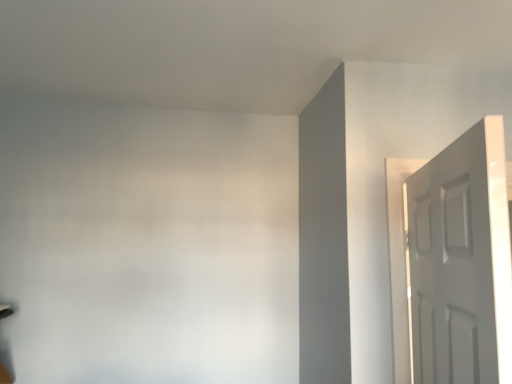
Where is `white matte door at right`? white matte door at right is located at coordinates (453, 263).

The width and height of the screenshot is (512, 384). What do you see at coordinates (453, 263) in the screenshot?
I see `white matte door at right` at bounding box center [453, 263].

Measure the distance between point (x=442, y=178) and camera.

Point (x=442, y=178) and camera are 3.71 feet apart.

Identify the location of white matte door at right. Image resolution: width=512 pixels, height=384 pixels. pos(453,263).